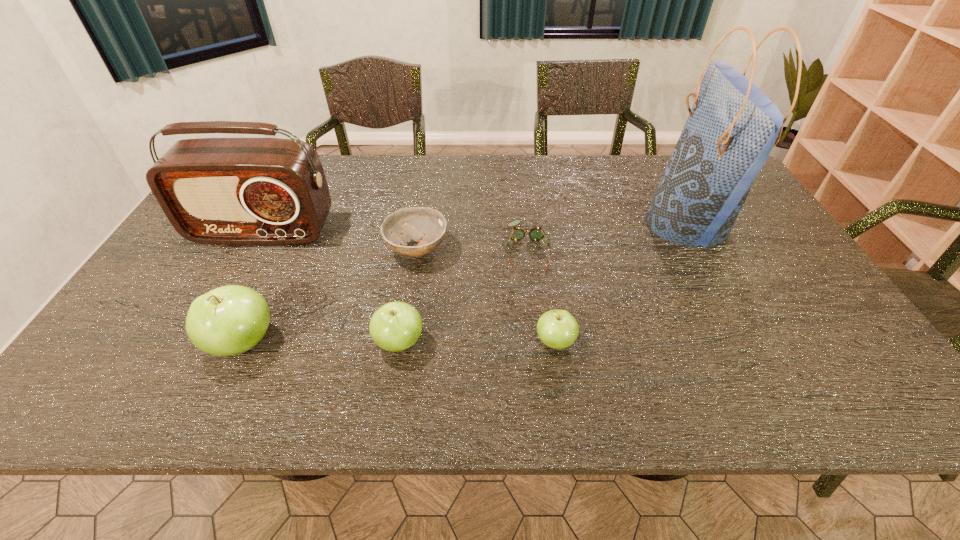
The apples are evenly distributed in the image. To maintain this, where would you place another apple on the right? Please point to a free space. Please provide its 2D coordinates. Your answer should be formatted as a tuple, i.e. [(x, y)], where the tuple contains the x and y coordinates of a point satisfying the conditions above.

[(710, 341)]